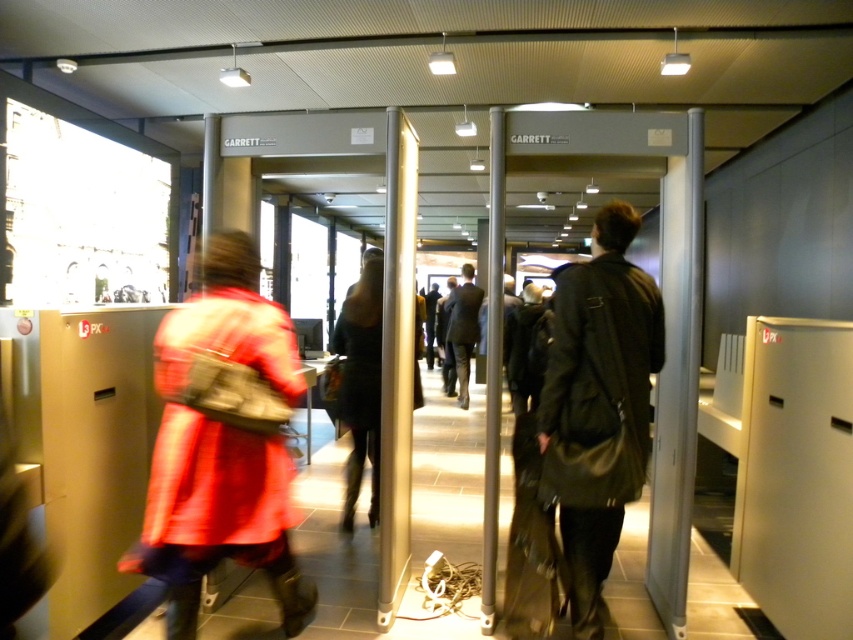
Does matte red coat at center appear under dark green leather jacket at center?

Yes, matte red coat at center is below dark green leather jacket at center.

Which of these two, matte red coat at center or dark green leather jacket at center, stands shorter?

Standing shorter between the two is matte red coat at center.

Which is in front, point (194, 444) or point (589, 580)?

Point (194, 444) is in front.

Where is `matte red coat at center`? matte red coat at center is located at coordinates (221, 445).

In the scene shown: Is matte red coat at center wider than dark gray suit at center?

Yes, matte red coat at center is wider than dark gray suit at center.

Is matte red coat at center smaller than dark gray suit at center?

Yes.

The height and width of the screenshot is (640, 853). I want to click on matte red coat at center, so click(221, 445).

What do you see at coordinates (596, 404) in the screenshot?
I see `dark green leather jacket at center` at bounding box center [596, 404].

Between dark green leather jacket at center and dark gray suit at center, which one is positioned higher?

dark gray suit at center is higher up.

Does point (569, 401) come farther from viewer compared to point (477, 339)?

That is False.

Where is `dark green leather jacket at center`? This screenshot has width=853, height=640. dark green leather jacket at center is located at coordinates (596, 404).